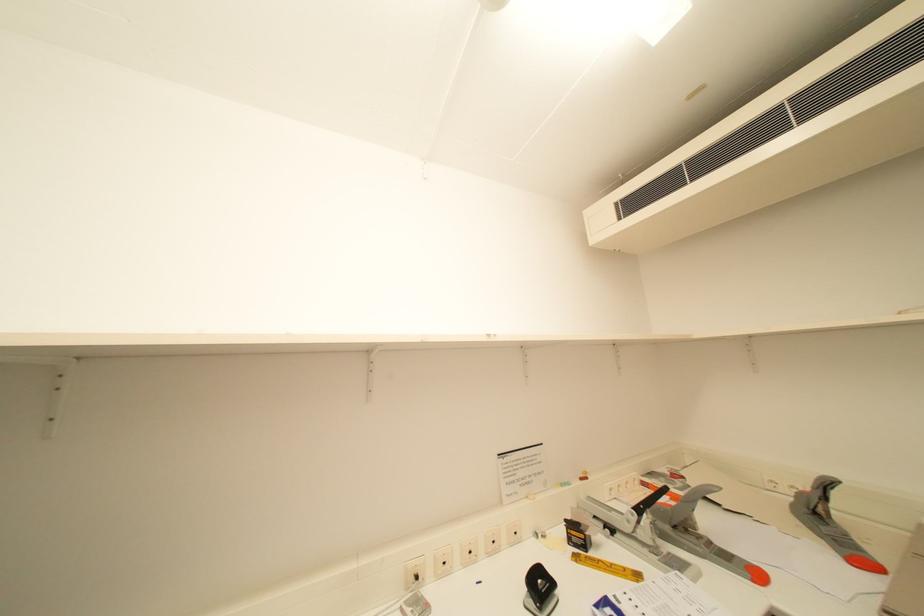
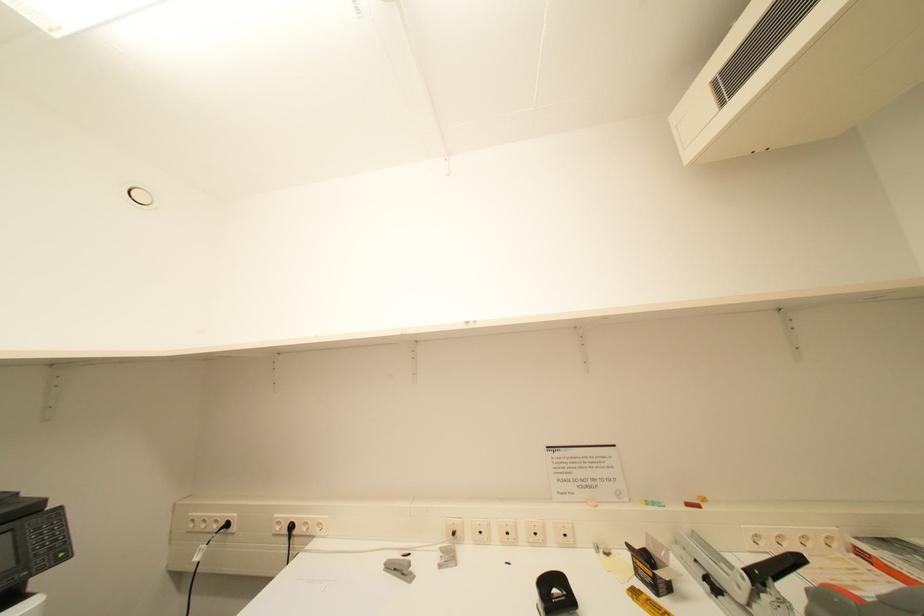
Question: Based on the continuous images, in which direction is the camera rotating? Reply with the corresponding letter.

Choices:
 (A) Left
 (B) Right
 (C) Up
 (D) Down

Answer: (A)